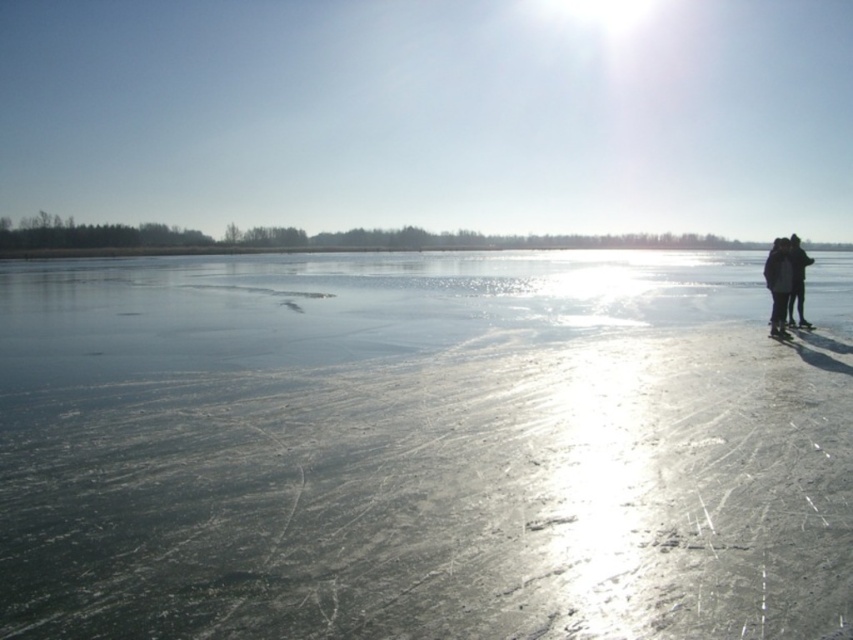
You are a photographer trying to capture a photo of the two people wearing dark gray woolen jackets at right and black matte jacket at right. Since the sun is causing a lens flare in the upper right corner, you want to position yourself so that the taller person blocks the glare. Which jacket should you ask to stand in front?

The dark gray woolen jackets at right is much taller than the black matte jacket at right, so you should ask the person wearing the dark gray woolen jackets at right to stand in front to block the glare.

You are a photographer trying to capture a photo of the two people in the winter scene. You want to ensure that both the dark gray woolen jackets at right and the black matte jacket at right are clearly visible in your shot. Based on their positions, which jacket should you focus on first to ensure both are in frame?

The dark gray woolen jackets at right is positioned on the left side of black matte jacket at right. Therefore, focusing on the dark gray woolen jackets at right first will ensure that the black matte jacket at right, which is to its right, remains within the frame as well.